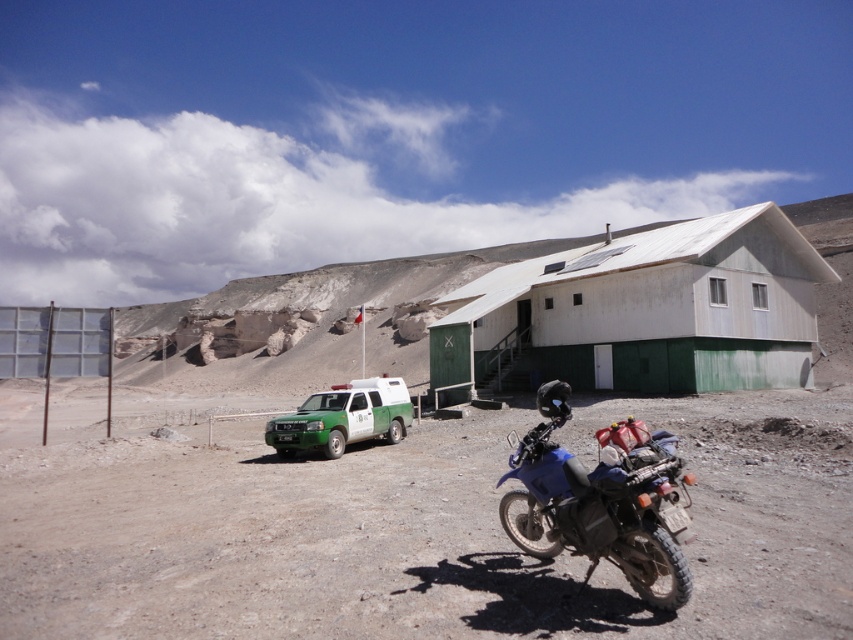
Who is more distant from viewer, (460, 300) or (572, 480)?

The point (460, 300) is more distant.

How distant is white matte hut at center from blue matte motorcycle at center?

white matte hut at center and blue matte motorcycle at center are 22.31 meters apart from each other.

Image resolution: width=853 pixels, height=640 pixels. What do you see at coordinates (651, 308) in the screenshot? I see `white matte hut at center` at bounding box center [651, 308].

Identify the location of white matte hut at center. (651, 308).

Which is more to the left, blue matte motorcycle at center or green matte utility vehicle at lower left?

From the viewer's perspective, green matte utility vehicle at lower left appears more on the left side.

Who is more forward, (525,508) or (392,440)?

Positioned in front is point (525,508).

What do you see at coordinates (601, 508) in the screenshot? I see `blue matte motorcycle at center` at bounding box center [601, 508].

Identify the location of blue matte motorcycle at center. The image size is (853, 640). (601, 508).

From the picture: Who is higher up, white matte hut at center or green matte utility vehicle at lower left?

white matte hut at center

This screenshot has height=640, width=853. What do you see at coordinates (651, 308) in the screenshot?
I see `white matte hut at center` at bounding box center [651, 308].

Locate an element on the screen. This screenshot has height=640, width=853. white matte hut at center is located at coordinates (651, 308).

Identify the location of white matte hut at center. (651, 308).